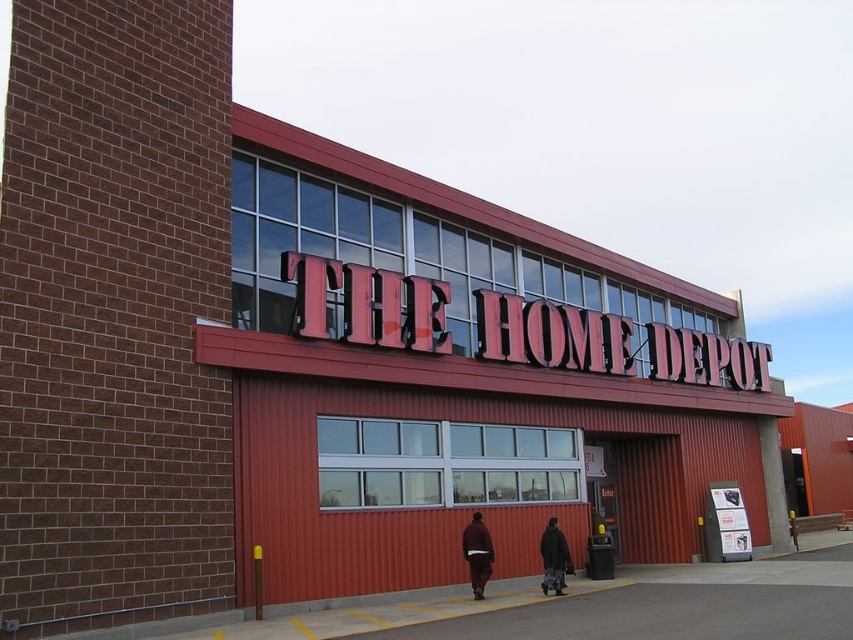
Does brown wool sweater at center appear under dark brown textured coat at center?

No, brown wool sweater at center is not below dark brown textured coat at center.

How much distance is there between brown wool sweater at center and dark brown textured coat at center?

brown wool sweater at center and dark brown textured coat at center are 1.71 meters apart.

Is point (469, 550) in front of point (560, 552)?

That is True.

You are a GUI agent. You are given a task and a screenshot of the screen. Output one action in this format:
    pyautogui.click(x=<x>, y=<y>)
    Task: Click on the brown wool sweater at center
    
    Given the screenshot: What is the action you would take?
    pyautogui.click(x=477, y=554)